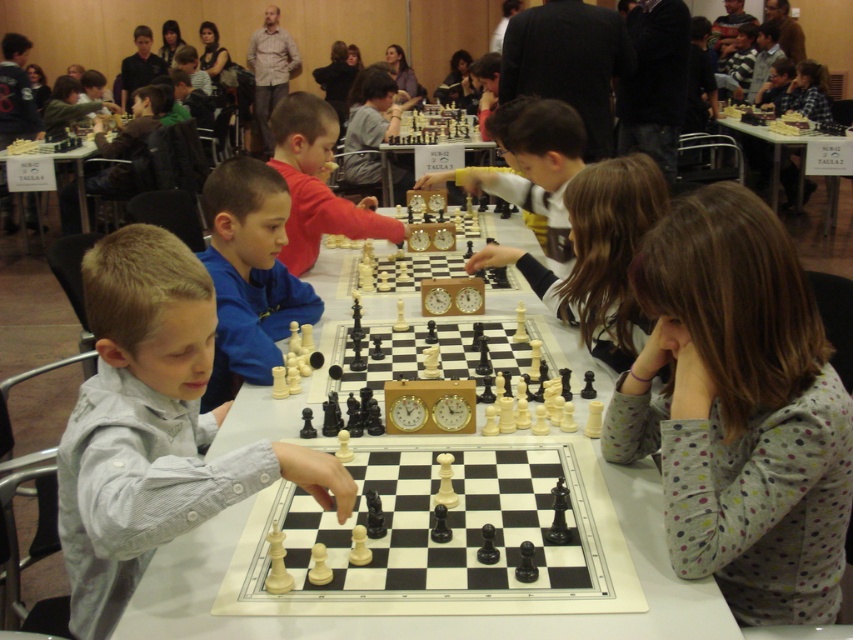
Question: Which object appears farthest from the camera in this image?

Choices:
 (A) wooden chess clock at center
 (B) wooden chess set at center

Answer: (B)

Question: Which point is farther to the camera?

Choices:
 (A) smooth wooden chessboard at center
 (B) smooth red shirt at center
 (C) wooden chess set at center
 (D) white plastic chessboard at center

Answer: (C)

Question: Observing the image, what is the correct spatial positioning of smooth wooden chessboard at center in reference to wooden chess clock at center?

Choices:
 (A) above
 (B) below

Answer: (B)

Question: Among these points, which one is nearest to the camera?

Choices:
 (A) (442, 132)
 (B) (579, 157)
 (C) (631, 536)

Answer: (C)

Question: Can you confirm if smooth wooden chessboard at center is bigger than smooth red shirt at center?

Choices:
 (A) yes
 (B) no

Answer: (B)

Question: Does wooden chessboard at center have a greater width compared to white plastic table at upper right?

Choices:
 (A) yes
 (B) no

Answer: (A)